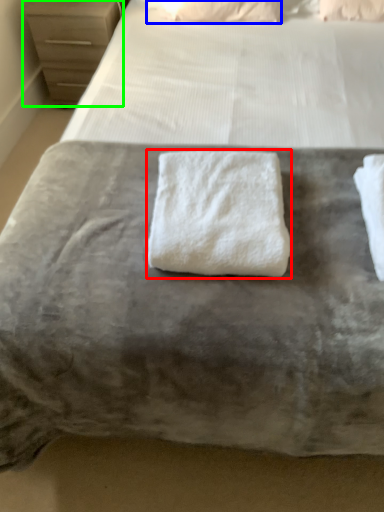
Question: Considering the real-world distances, which object is farthest from towel (highlighted by a red box)? pillow (highlighted by a blue box) or chest of drawers (highlighted by a green box)?

Choices:
 (A) pillow
 (B) chest of drawers

Answer: (B)